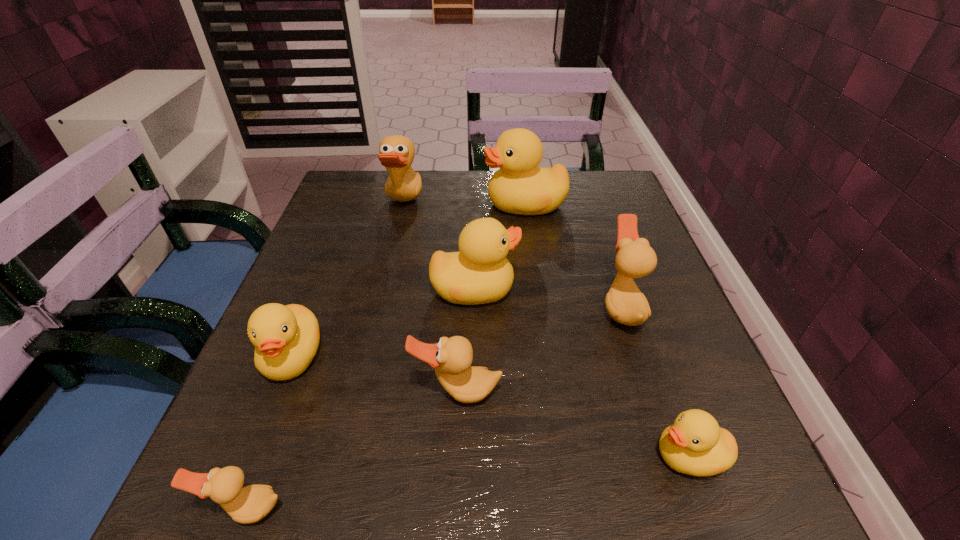
Where is `vacant area at the near edge`? This screenshot has height=540, width=960. vacant area at the near edge is located at coordinates (403, 471).

The height and width of the screenshot is (540, 960). In order to click on vacant space at the left edge in this screenshot , I will do `click(320, 350)`.

Locate an element on the screen. This screenshot has width=960, height=540. vacant space at the right edge is located at coordinates (650, 414).

Where is `free location at the far left corner of the desktop`? free location at the far left corner of the desktop is located at coordinates (361, 193).

Locate an element on the screen. The image size is (960, 540). vacant region at the far right corner of the desktop is located at coordinates (612, 192).

Locate an element on the screen. free space between the rightmost tan duck and the leftmost tan duck is located at coordinates (433, 408).

This screenshot has height=540, width=960. Find the location of `unoccupied area between the rightmost tan duck and the second tan duck from left to right`. unoccupied area between the rightmost tan duck and the second tan duck from left to right is located at coordinates (513, 256).

Locate an element on the screen. Image resolution: width=960 pixels, height=540 pixels. vacant area between the rightmost tan duck and the second nearest duck is located at coordinates (655, 382).

The width and height of the screenshot is (960, 540). What are the coordinates of `vacant space that's between the second nearest yellow duck and the second farthest yellow duck` in the screenshot? It's located at (383, 323).

Where is `free point between the leftmost tan duck and the third nearest yellow duck`? free point between the leftmost tan duck and the third nearest yellow duck is located at coordinates (360, 399).